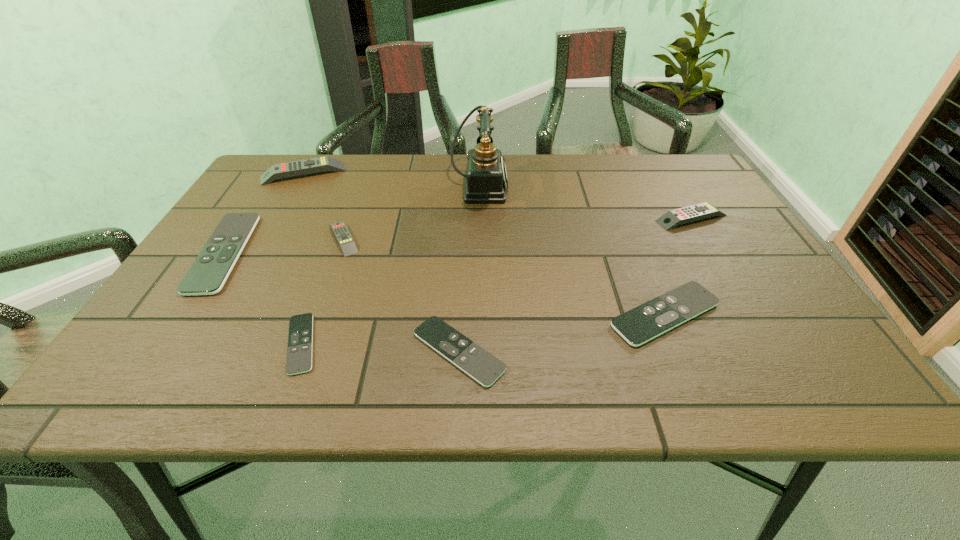
This screenshot has height=540, width=960. I want to click on vacant point at the right edge, so click(722, 218).

Find the location of a particular element. The width and height of the screenshot is (960, 540). free location at the far left corner of the desktop is located at coordinates (278, 161).

Identify the location of vacant space at the near left corner of the desktop. (117, 382).

In the image, there is a desktop. In order to click on vacant space at the far right corner in this screenshot , I will do click(x=649, y=168).

At what (x,y) coordinates should I click in order to perform the action: click on unoccupied position between the fourth shortest remote control and the rightmost black remote control. Please return your answer as a coordinate pair (x, y). This screenshot has width=960, height=540. Looking at the image, I should click on (444, 284).

What are the coordinates of `empty location between the sixth shortest remote control and the smallest black remote control` in the screenshot? It's located at click(496, 281).

Where is `vacant space in between the biggest black remote control and the sixth tallest object`? Image resolution: width=960 pixels, height=540 pixels. vacant space in between the biggest black remote control and the sixth tallest object is located at coordinates (444, 284).

Where is `vacant space that's between the third shortest remote control and the sixth shortest object`? Image resolution: width=960 pixels, height=540 pixels. vacant space that's between the third shortest remote control and the sixth shortest object is located at coordinates (678, 266).

Find the location of a particular element. This screenshot has width=960, height=540. vacant space that's between the seventh shortest object and the fifth shortest remote control is located at coordinates (324, 206).

The image size is (960, 540). Identify the location of vacant point located between the seventh shortest object and the smallest yellow remote control. (324, 206).